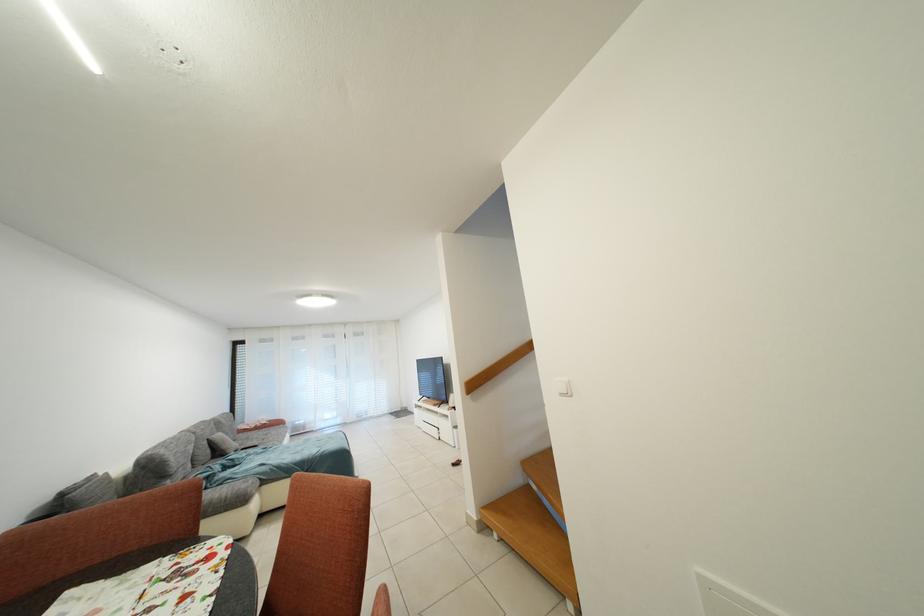
Describe the element at coordinates (496, 367) in the screenshot. I see `the wooden stair handrail` at that location.